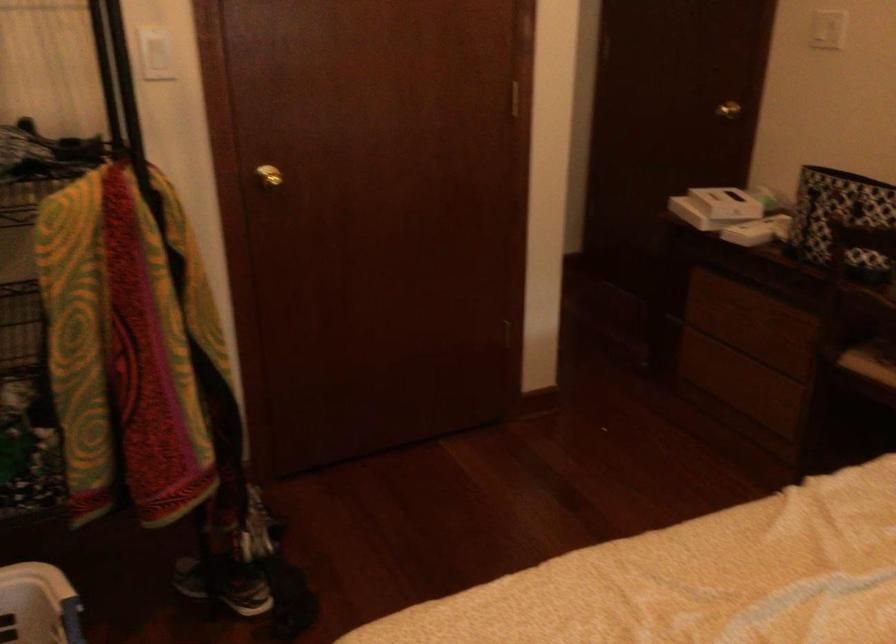
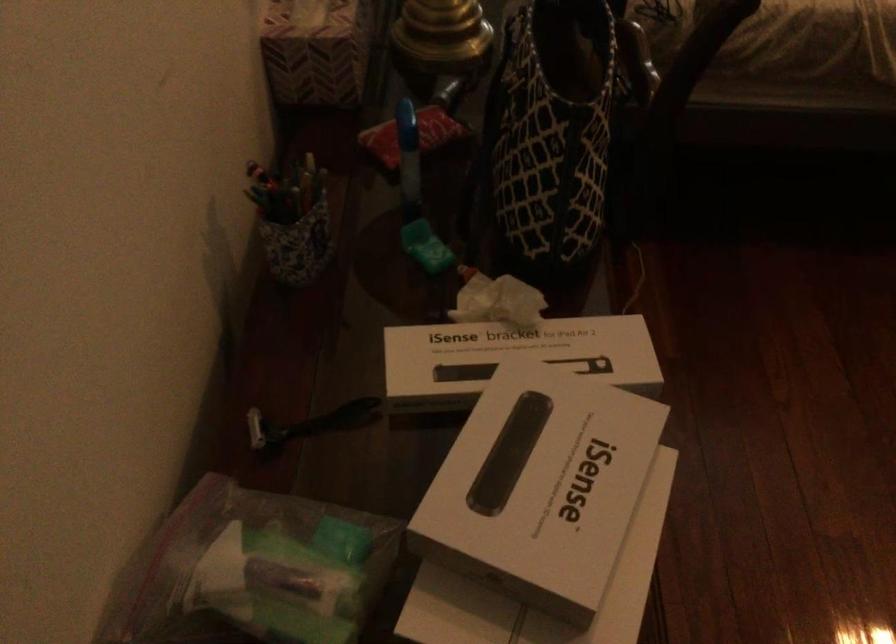
In the second image, find the point that corresponds to the point at 745,200 in the first image.

(515, 353)